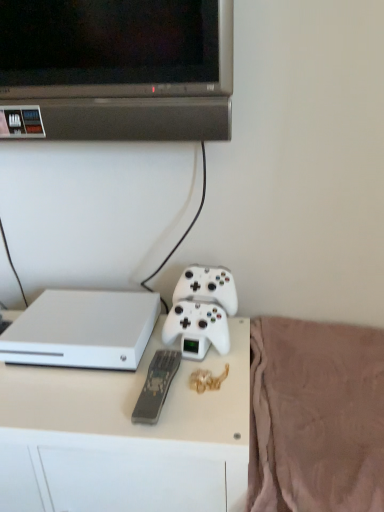
The height and width of the screenshot is (512, 384). I want to click on white plastic desk at center, so click(125, 437).

The width and height of the screenshot is (384, 512). What do you see at coordinates (125, 437) in the screenshot? I see `white plastic desk at center` at bounding box center [125, 437].

Where is `pink soft fabric at lower right`? pink soft fabric at lower right is located at coordinates [316, 416].

The image size is (384, 512). Describe the element at coordinates (316, 416) in the screenshot. I see `pink soft fabric at lower right` at that location.

In order to click on white matte gaming console at lower left in this screenshot , I will do `click(82, 330)`.

This screenshot has height=512, width=384. I want to click on white plastic desk at center, so click(125, 437).

Considering the positions of objects white plastic desk at center and pink soft fabric at lower right in the image provided, who is more to the right, white plastic desk at center or pink soft fabric at lower right?

Positioned to the right is pink soft fabric at lower right.

Is white plastic desk at center with pink soft fabric at lower right?

No, white plastic desk at center is not making contact with pink soft fabric at lower right.

Does white plastic desk at center contain pink soft fabric at lower right?

No, white plastic desk at center does not contain pink soft fabric at lower right.

Could you tell me if white matte gaming console at lower left is facing gray matte remote at center?

No, white matte gaming console at lower left is not turned towards gray matte remote at center.

Which is in front, white matte gaming console at lower left or gray matte remote at center?

gray matte remote at center is more forward.

From the image's perspective, is white matte gaming console at lower left positioned above or below gray matte remote at center?

From the image's perspective, white matte gaming console at lower left appears above gray matte remote at center.

Is white plastic desk at center bigger or smaller than white matte gaming console at lower left?

In the image, white plastic desk at center appears to be larger than white matte gaming console at lower left.

Based on the photo, does white plastic desk at center contain white matte gaming console at lower left?

No.

Considering the positions of point (61, 374) and point (152, 313), is point (61, 374) closer or farther from the camera than point (152, 313)?

Point (61, 374) appears to be closer to the viewer than point (152, 313).

From a real-world perspective, is white plastic desk at center positioned under white matte gaming console at lower left based on gravity?

Yes.

From a real-world perspective, is pink soft fabric at lower right located higher than white matte game controller at center?

No, from a real-world perspective, pink soft fabric at lower right is not above white matte game controller at center.

Choose the correct answer: Is pink soft fabric at lower right inside white matte game controller at center or outside it?

pink soft fabric at lower right is not enclosed by white matte game controller at center.

Considering the positions of points (252, 402) and (192, 273), is point (252, 402) closer to camera compared to point (192, 273)?

Yes, it is.

Based on the photo, which object is positioned more to the right, white matte game controller at center or pink soft fabric at lower right?

Positioned to the right is pink soft fabric at lower right.

Which is behind, point (210, 306) or point (286, 483)?

Positioned behind is point (210, 306).

Where is `blanket that appears below the white matte game controller at center (from the image's perspective)`? blanket that appears below the white matte game controller at center (from the image's perspective) is located at coordinates (316, 416).

From the image's perspective, is white plastic desk at center above gray matte remote at center?

No, from the image's perspective, white plastic desk at center is not over gray matte remote at center.

In the scene shown: Is gray matte remote at center a part of white plastic desk at center?

Yes, gray matte remote at center can be found within white plastic desk at center.

From a real-world perspective, is white plastic desk at center above or below gray matte remote at center?

In terms of real-world spatial position, white plastic desk at center is below gray matte remote at center.

Consider the image. Could you tell me if white matte gaming console at lower left is turned towards pink soft fabric at lower right?

No, white matte gaming console at lower left is not turned towards pink soft fabric at lower right.

Looking at this image, is white matte gaming console at lower left closer to the viewer compared to pink soft fabric at lower right?

No.

Does white matte gaming console at lower left have a greater width compared to pink soft fabric at lower right?

No, white matte gaming console at lower left is not wider than pink soft fabric at lower right.

Based on the photo, is white matte gaming console at lower left bigger than pink soft fabric at lower right?

Actually, white matte gaming console at lower left might be smaller than pink soft fabric at lower right.

Where is `desk that is under the pink soft fabric at lower right (from a real-world perspective)`? desk that is under the pink soft fabric at lower right (from a real-world perspective) is located at coordinates (125, 437).

What are the coordinates of `remote located below the white matte gaming console at lower left (from the image's perspective)` in the screenshot? It's located at (156, 386).

Based on their spatial positions, is gray matte remote at center or white matte game controller at center closer to white matte gaming console at lower left?

Based on the image, white matte game controller at center appears to be nearer to white matte gaming console at lower left.

Looking at the image, which one is located closer to white matte gaming console at lower left, white matte game controller at center or pink soft fabric at lower right?

white matte game controller at center.

Consider the image. From the image, which object appears to be nearer to gray matte remote at center, pink soft fabric at lower right or white plastic desk at center?

white plastic desk at center.

From the image, which object appears to be nearer to pink soft fabric at lower right, white matte game controller at center or white plastic desk at center?

Based on the image, white plastic desk at center appears to be nearer to pink soft fabric at lower right.

Estimate the real-world distances between objects in this image. Which object is closer to white plastic desk at center, gray matte remote at center or pink soft fabric at lower right?

gray matte remote at center is positioned closer to the anchor white plastic desk at center.

Estimate the real-world distances between objects in this image. Which object is closer to pink soft fabric at lower right, gray matte remote at center or white matte gaming console at lower left?

The object closer to pink soft fabric at lower right is gray matte remote at center.

Estimate the real-world distances between objects in this image. Which object is further from white plastic desk at center, pink soft fabric at lower right or white matte game controller at center?

pink soft fabric at lower right.

Considering their positions, is white plastic desk at center positioned further to white matte gaming console at lower left than pink soft fabric at lower right?

pink soft fabric at lower right lies further to white matte gaming console at lower left than the other object.

Image resolution: width=384 pixels, height=512 pixels. Find the location of `remote located between white plastic desk at center and pink soft fabric at lower right in the left-right direction`. remote located between white plastic desk at center and pink soft fabric at lower right in the left-right direction is located at coordinates (156, 386).

Identify the location of remote situated between white matte gaming console at lower left and white matte game controller at center from left to right. This screenshot has height=512, width=384. (156, 386).

I want to click on game controller situated between white matte gaming console at lower left and pink soft fabric at lower right from left to right, so click(x=201, y=311).

At what (x,y) coordinates should I click in order to perform the action: click on computer located between white plastic desk at center and pink soft fabric at lower right in the left-right direction. Please return your answer as a coordinate pair (x, y). Image resolution: width=384 pixels, height=512 pixels. Looking at the image, I should click on 82,330.